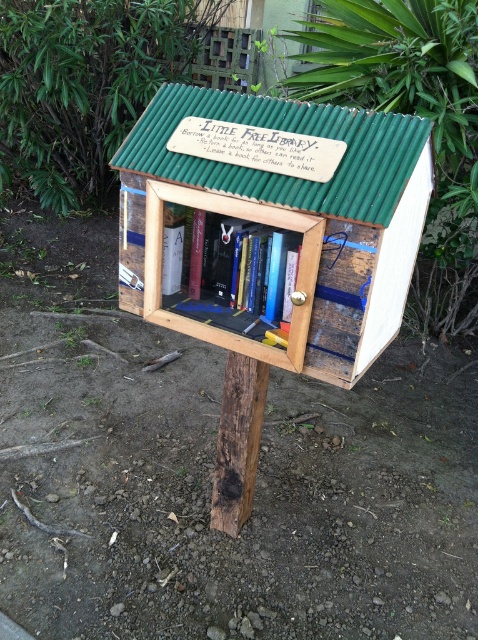
You are organizing a book donation drive and have a large wooden bookshelf at center and a hardcover book at center. Which item is bigger in size?

The wooden bookshelf at center has a larger size compared to the hardcover book at center, so the wooden bookshelf at center is bigger.